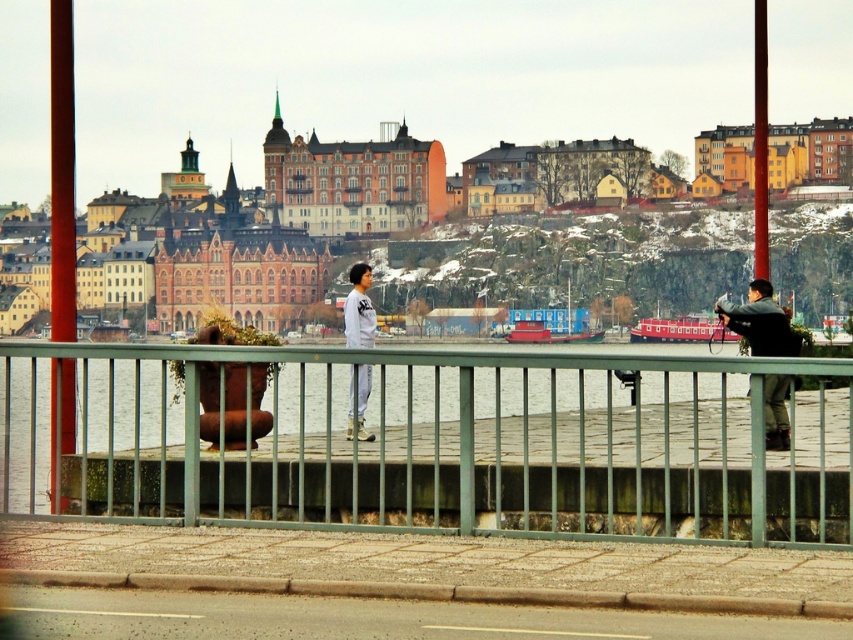
You are standing on a bridge and want to take a photo of the green metal fence at center and the dark gray jacket at right. If your camera can focus on objects up to 10 meters away, will both subjects be in focus?

The green metal fence at center is 13.55 meters from the dark gray jacket at right. Since the camera can only focus up to 10 meters, the fence is farther than 10 meters away, so it will be out of focus while the jacket might be in focus if it is within 10 meters.

You are a photographer positioned on the bridge. You notice two people wearing jackets. One is wearing a dark gray jacket at right and the other a white matte jacket at center. Which jacket is closer to you?

The dark gray jacket at right is closer to you because it is in front of the white matte jacket at center.

You are standing on the bridge and want to place a small potted plant between the green metal fence at center and the railing edge. Is there enough space for the plant?

The green metal fence at center is located at point (438, 444), so there is sufficient space between it and the railing edge to place the small potted plant.